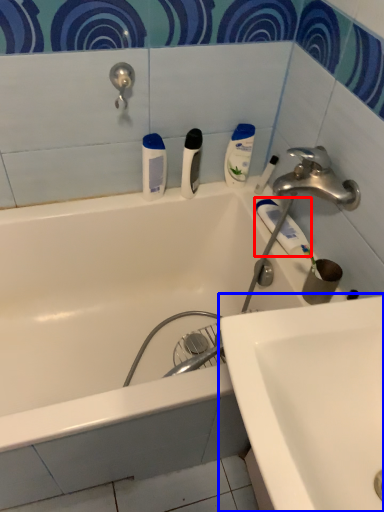
Question: Which of the following is the farthest to the observer, toothpaste (highlighted by a red box) or sink (highlighted by a blue box)?

Choices:
 (A) toothpaste
 (B) sink

Answer: (A)